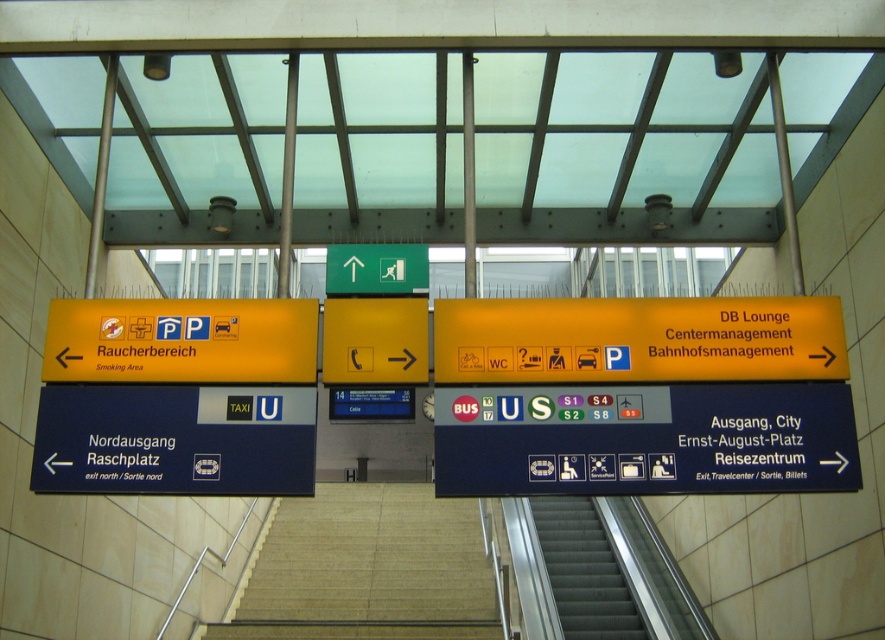
You are a traveler at the station and need to find the nearest exit. You see the blue metallic sign at left and the yellow matte sign at left. Which sign should you look at for exit information?

The blue metallic sign at left directs travelers towards specific exits, so you should look at the blue metallic sign at left for exit information.